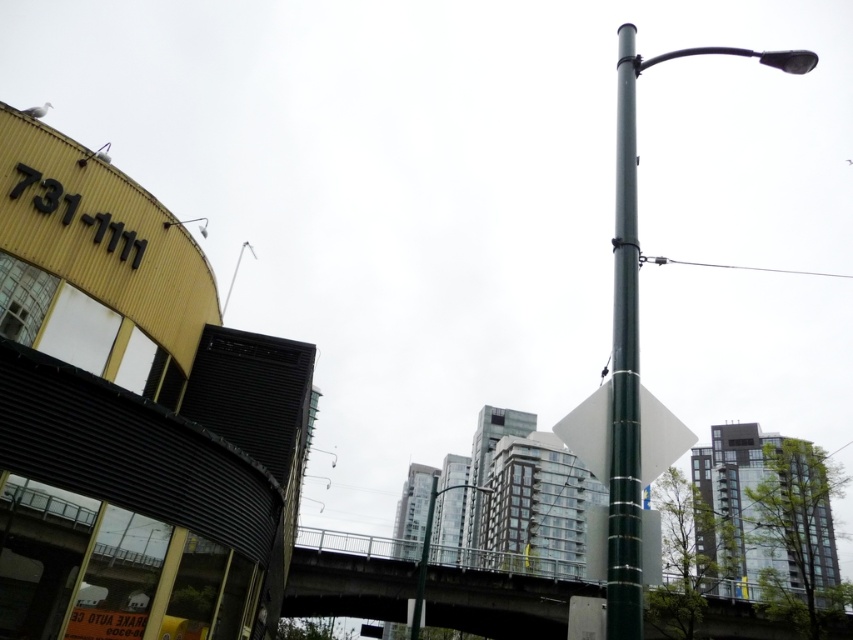
In the scene shown: Is concrete bridge at center shorter than silver metallic street light at upper center?

Yes, concrete bridge at center is shorter than silver metallic street light at upper center.

Is concrete bridge at center below silver metallic street light at upper center?

Correct, concrete bridge at center is located below silver metallic street light at upper center.

This screenshot has height=640, width=853. In order to click on concrete bridge at center in this screenshot , I will do `click(349, 577)`.

Does point (619, 152) come in front of point (202, 228)?

Yes, point (619, 152) is closer to viewer.

Is green metallic pole at center positioned behind metallic street light at upper center?

No, green metallic pole at center is closer to the viewer.

Is point (634, 90) positioned behind point (170, 221)?

No, (634, 90) is closer to viewer.

Image resolution: width=853 pixels, height=640 pixels. Identify the location of green metallic pole at center. (624, 369).

What do you see at coordinates (349, 577) in the screenshot? I see `concrete bridge at center` at bounding box center [349, 577].

Who is taller, concrete bridge at center or metallic pole at center?

With more height is metallic pole at center.

Is point (308, 573) in front of point (482, 486)?

No.

Where is `concrete bridge at center`? concrete bridge at center is located at coordinates (349, 577).